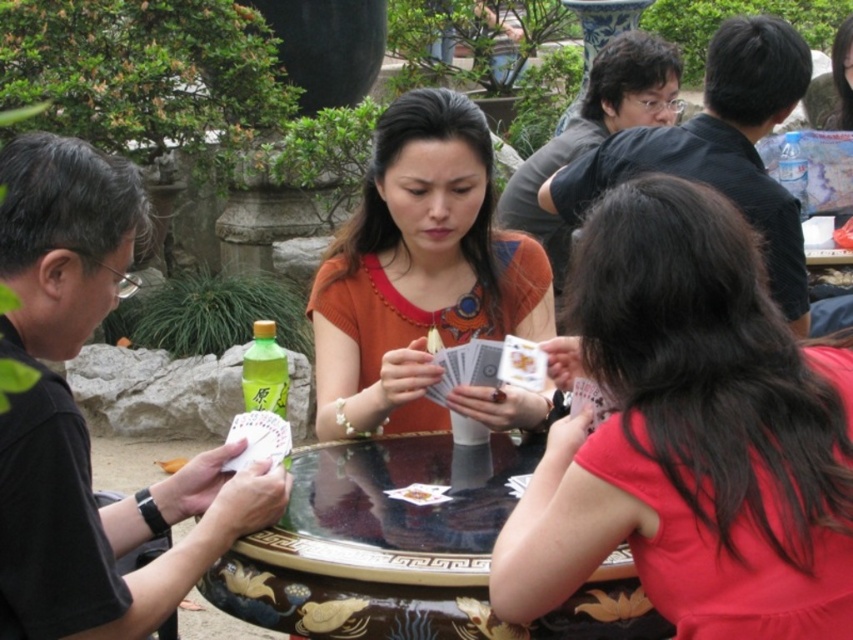
Who is shorter, orange knitted sweater at center or black glossy shirt at upper right?

black glossy shirt at upper right is shorter.

Which is more to the right, orange knitted sweater at center or black glossy shirt at upper right?

black glossy shirt at upper right

Between point (328, 305) and point (738, 33), which one is positioned behind?

Point (738, 33)

Find the location of a particular element. This screenshot has width=853, height=640. orange knitted sweater at center is located at coordinates pyautogui.click(x=418, y=269).

Based on the photo, can you confirm if matte red shirt at lower right is shorter than wooden polished table at center?

In fact, matte red shirt at lower right may be taller than wooden polished table at center.

The image size is (853, 640). What do you see at coordinates (691, 435) in the screenshot?
I see `matte red shirt at lower right` at bounding box center [691, 435].

Based on the photo, who is more distant from viewer, (x=683, y=616) or (x=402, y=442)?

Point (x=402, y=442)

The image size is (853, 640). I want to click on matte red shirt at lower right, so click(x=691, y=435).

Can you confirm if black matte shirt at left is taller than green matte bottle at center?

Yes, black matte shirt at left is taller than green matte bottle at center.

Between point (115, 273) and point (265, 364), which one is positioned in front?

Point (115, 273)

Find the location of a particular element. Image resolution: width=853 pixels, height=640 pixels. black matte shirt at left is located at coordinates (106, 525).